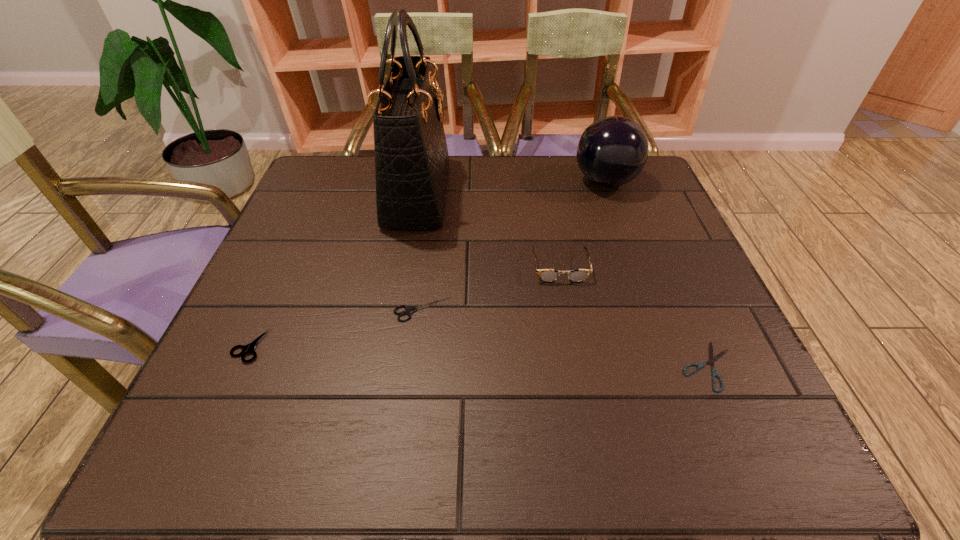
Find the location of a particular element. This screenshot has width=960, height=540. the tallest object is located at coordinates (411, 156).

Find the location of a particular element. bowling ball is located at coordinates point(612,151).

Identify the location of the third farthest object. tap(546, 275).

The image size is (960, 540). What are the coordinates of `the third tallest object` in the screenshot? It's located at (546, 275).

You are a GUI agent. You are given a task and a screenshot of the screen. Output one action in this format:
    pyautogui.click(x=<x>, y=<y>)
    Task: Click on the leftmost shears
    The height and width of the screenshot is (540, 960).
    Given the screenshot: What is the action you would take?
    point(249,348)

Locate an element on the screen. Image resolution: width=960 pixels, height=540 pixels. the tallest shears is located at coordinates (249, 348).

What are the coordinates of `the second shears from left to right` in the screenshot? It's located at (408, 311).

In order to click on the fourth farthest object in this screenshot , I will do `click(408, 311)`.

The width and height of the screenshot is (960, 540). Identify the location of the shortest object. (714, 373).

Identify the location of the rightmost shears. (714, 373).